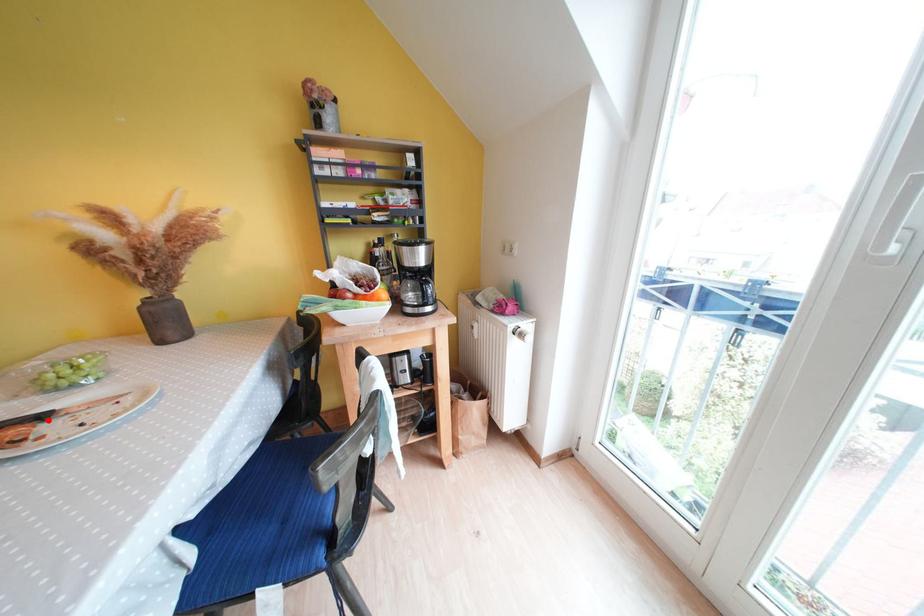
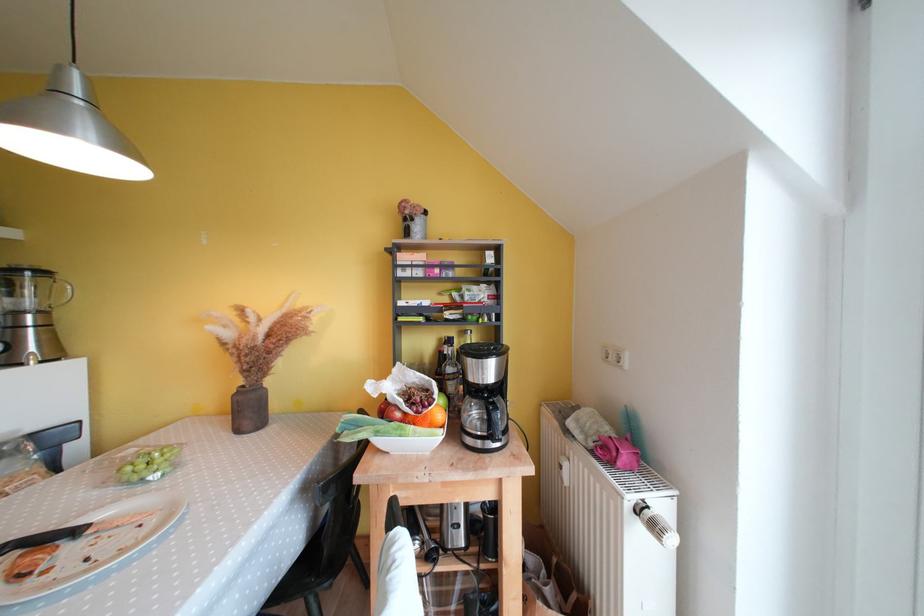
Find the pixel in the second image that matches the highlighted location in the first image.

(83, 535)